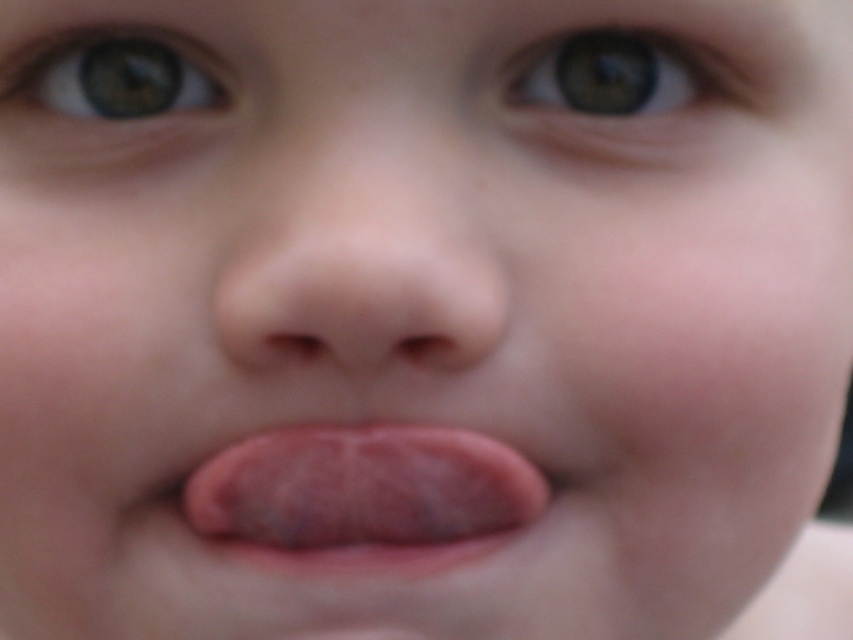
You are a photographer adjusting your camera settings to focus on two specific points in the image of a child sticking out their tongue. The points are labeled as point (387, 220) and point (111, 74). Which point should you focus on to ensure it appears sharp in the foreground?

Point (387, 220) is closer to the camera than point (111, 74), so you should focus on point (387, 220) to ensure it appears sharp in the foreground.

You are a dentist examining a child. You notice a small white spot at point (363, 497) on the child. Based on the image description, where is this spot located?

The point (363, 497) is on the pink flesh colored tongue at center, so the spot is located on the child s tongue.